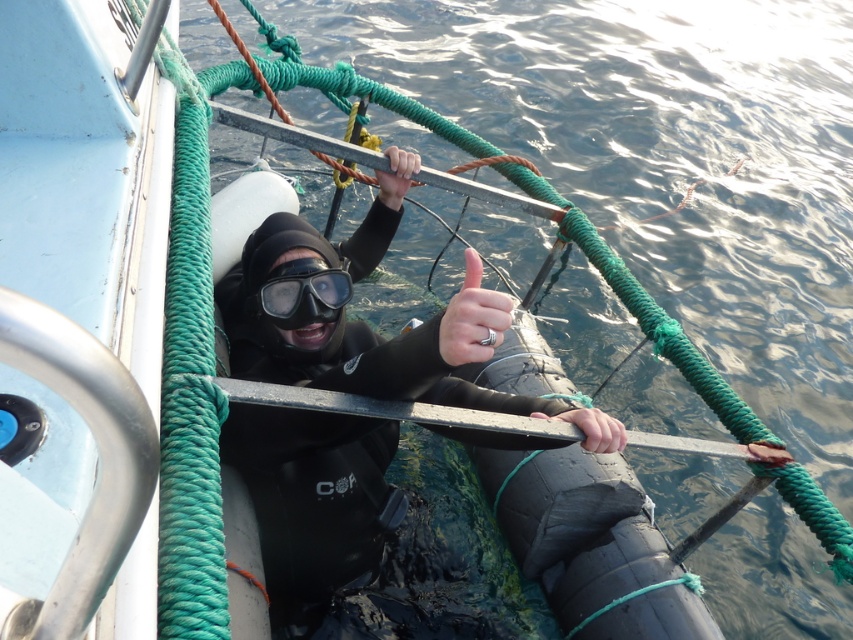
Question: Considering the relative positions of smooth black hand at center and matte black hand at upper center in the image provided, where is smooth black hand at center located with respect to matte black hand at upper center?

Choices:
 (A) below
 (B) above

Answer: (A)

Question: Estimate the real-world distances between objects in this image. Which object is closer to the smooth black hand at center?

Choices:
 (A) silver metallic ring at center
 (B) black matte wetsuit at center

Answer: (A)

Question: Is transparent rubber goggles at center positioned in front of smooth black hand at center?

Choices:
 (A) no
 (B) yes

Answer: (A)

Question: Which point is closer to the camera?

Choices:
 (A) (282, 445)
 (B) (769, 458)
 (C) (413, 166)
 (D) (450, 307)

Answer: (D)

Question: Does silver metallic ring at center have a larger size compared to matte black hand at upper center?

Choices:
 (A) yes
 (B) no

Answer: (B)

Question: Which point appears closest to the camera in this image?

Choices:
 (A) (766, 460)
 (B) (585, 416)
 (C) (386, 490)
 (D) (401, 161)

Answer: (B)